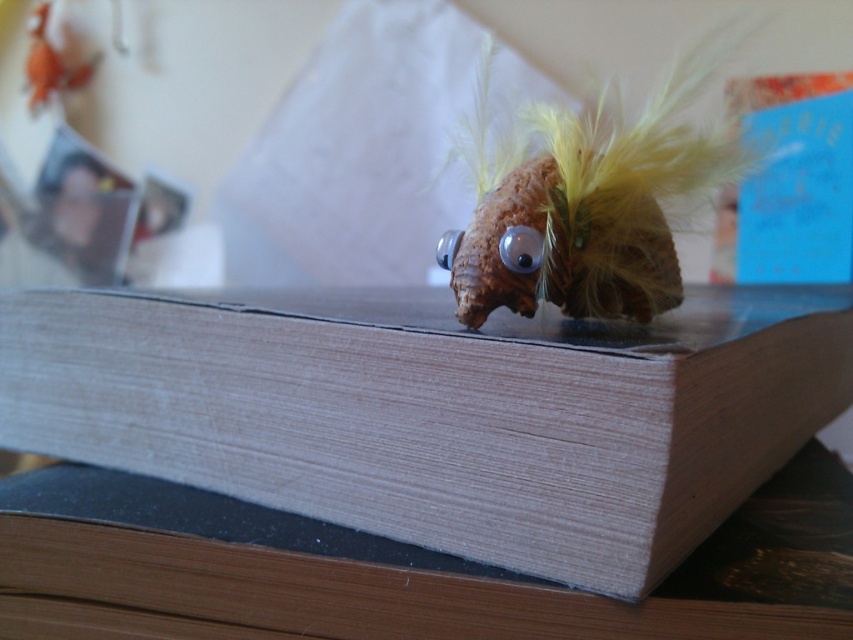
Question: From the image, what is the correct spatial relationship of wooden paperback book at center in relation to fuzzy brown snail at center?

Choices:
 (A) left
 (B) right

Answer: (A)

Question: Which point is closer to the camera?

Choices:
 (A) (30, 49)
 (B) (468, 509)
 (C) (625, 256)

Answer: (B)

Question: Can you confirm if wooden paperback book at center is thinner than fuzzy brown snail at center?

Choices:
 (A) yes
 (B) no

Answer: (B)

Question: Which object is closer to the camera taking this photo?

Choices:
 (A) fuzzy brown snail at center
 (B) orange plush toy at upper left

Answer: (A)

Question: Is wooden paperback book at center below orange plush toy at upper left?

Choices:
 (A) yes
 (B) no

Answer: (A)

Question: Which point is closer to the camera?

Choices:
 (A) fuzzy brown snail at center
 (B) wooden paperback book at center
 (C) orange plush toy at upper left

Answer: (B)